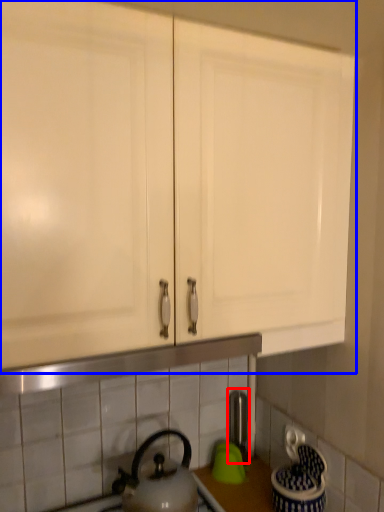
Question: Which object is closer to the camera taking this photo, faucet (highlighted by a red box) or cabinetry (highlighted by a blue box)?

Choices:
 (A) faucet
 (B) cabinetry

Answer: (B)